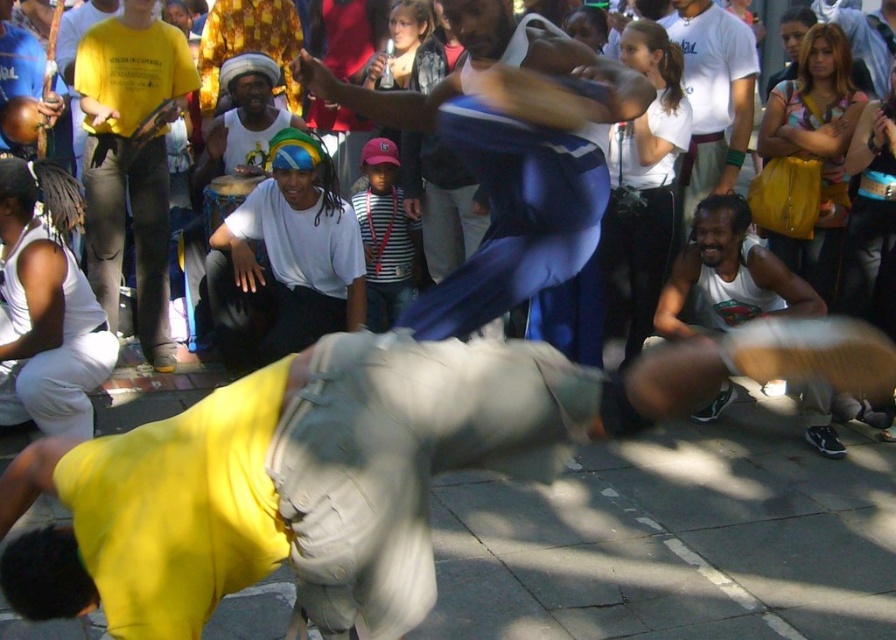
Question: From the image, what is the correct spatial relationship of blue fabric pants at center in relation to white fabric camera at center?

Choices:
 (A) above
 (B) below

Answer: (B)

Question: From the image, what is the correct spatial relationship of blue fabric pants at center in relation to white fabric camera at center?

Choices:
 (A) below
 (B) above

Answer: (A)

Question: Which of the following is the farthest from the observer?

Choices:
 (A) (606, 189)
 (B) (166, 301)

Answer: (B)

Question: Which point is closer to the camera?

Choices:
 (A) yellow t-shirt at left
 (B) blue fabric pants at center

Answer: (B)

Question: Does yellow t-shirt at left have a larger size compared to white fabric camera at center?

Choices:
 (A) yes
 (B) no

Answer: (A)

Question: Which of the following is the farthest from the observer?

Choices:
 (A) white cotton tank top at left
 (B) white fabric camera at center
 (C) blue fabric pants at center
 (D) yellow t-shirt at left

Answer: (D)